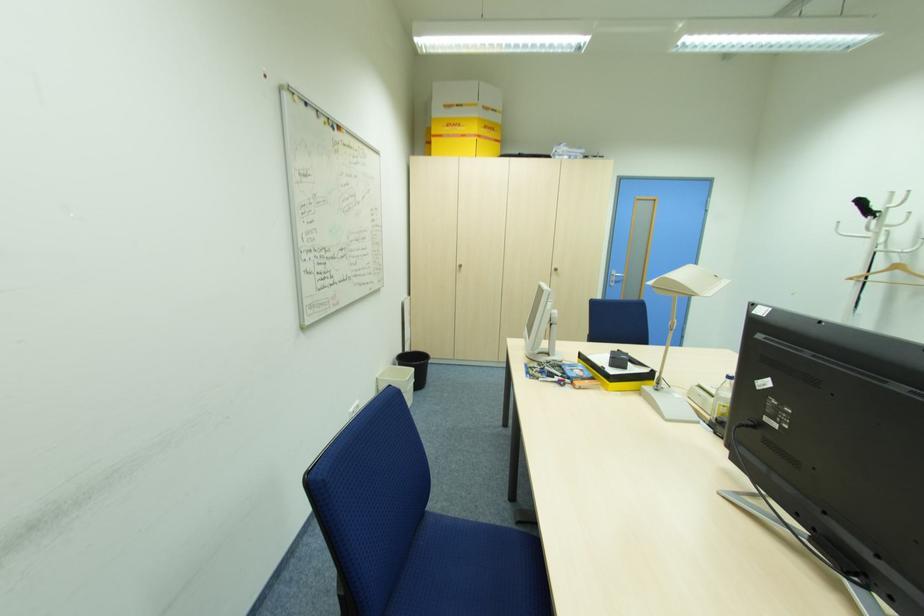
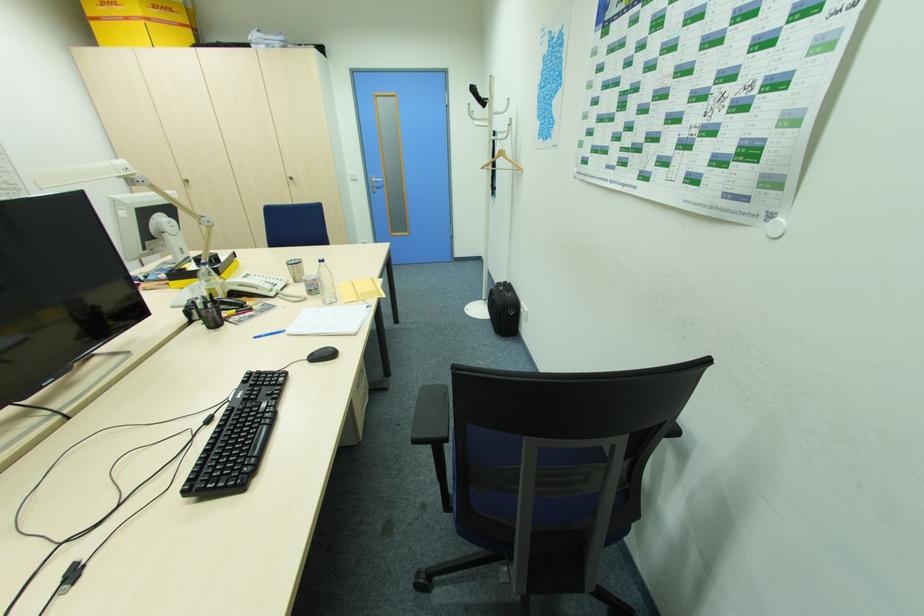
The point at (854, 278) is marked in the first image. Where is the corresponding point in the second image?

(485, 168)